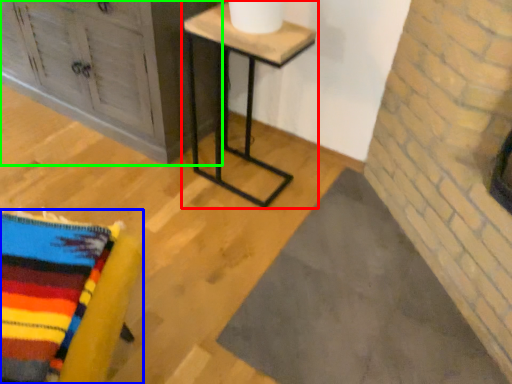
Question: Considering the real-world distances, which object is farthest from table (highlighted by a red box)? furniture (highlighted by a blue box) or furniture (highlighted by a green box)?

Choices:
 (A) furniture
 (B) furniture

Answer: (A)